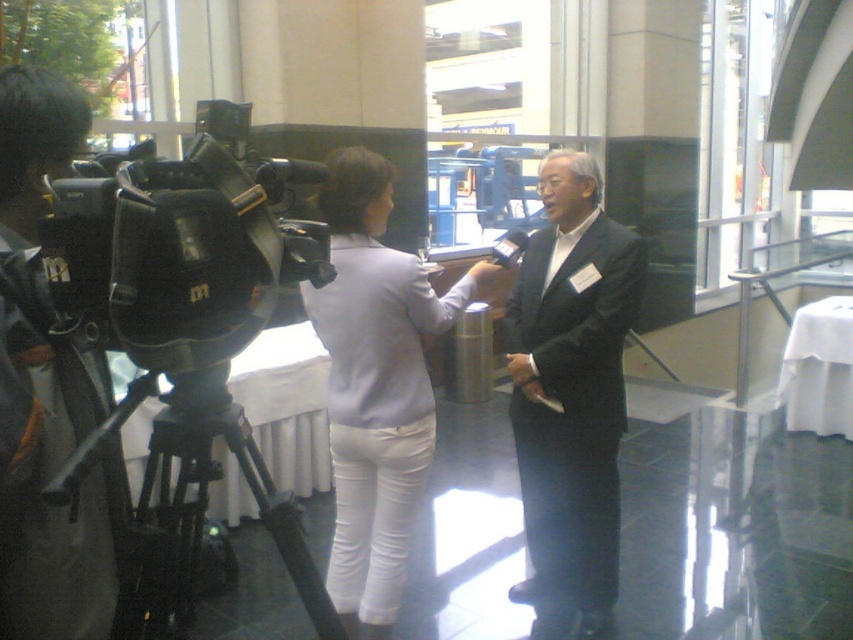
You are a photographer standing behind the matte black camera at left. You want to take a photo of the person in the matte black suit at center. Can you see them clearly from your current position?

Yes, the matte black suit at center is to the right of the matte black camera at left, so the photographer can see them clearly from their current position.

You are a stagehand preparing to move equipment. You need to place a new microphone stand between the matte black suit at center and the black matte tripod at lower left. Based on their positions, which object should you position the microphone stand closer to?

The microphone stand should be placed closer to the black matte tripod at lower left since the matte black suit at center is closer to the viewer, meaning the tripod is further back and has more space behind it for the microphone stand.

You are attending a media event and need to adjust your position to get a better view of the speaker. There is a light purple fabric jacket at center and a black matte tripod at lower left in your way. Which object is blocking your view more?

The black matte tripod at lower left is behind the light purple fabric jacket at center, so the light purple fabric jacket at center is closer to you and blocking your view more.